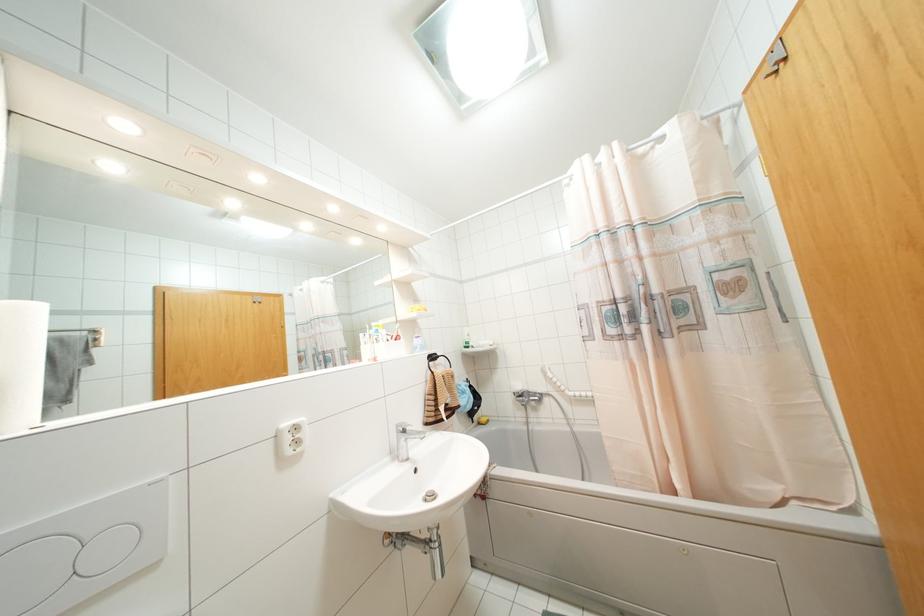
This screenshot has height=616, width=924. I want to click on white electrical outlet, so click(293, 428).